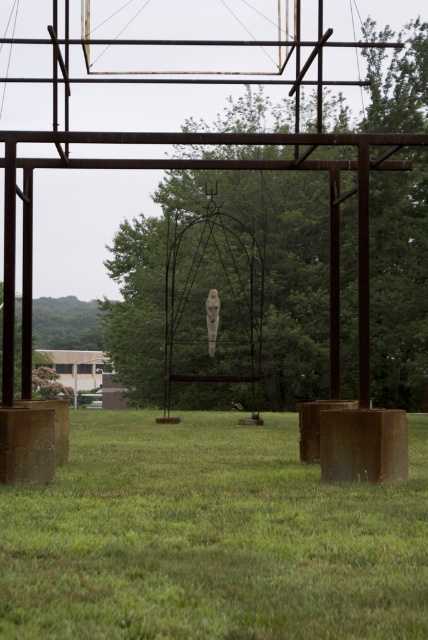
You are an art critic standing in front of the sculpture installation. You notice the green leafy tree at center and the white marble statue at center. Which object is closer to you?

The green leafy tree at center is closer to you because it is in front of the white marble statue at center.

Based on the photo, you are standing in front of the sculpture installation and want to take a photo of the green grass at center and the white marble statue at center. Which object should you focus on first to ensure both are in sharp focus?

You should focus on the green grass at center first since it is closer to the viewer than the white marble statue at center, allowing the statue to fall within the depth of field when focused on the closer object.

You are a gardener who needs to mow the green grass at center and clean the white marble statue at center. Which task should you do first if you want to tackle the shorter one first?

The green grass at center is not as tall as the white marble statue at center, so you should mow the green grass at center first since it is shorter.